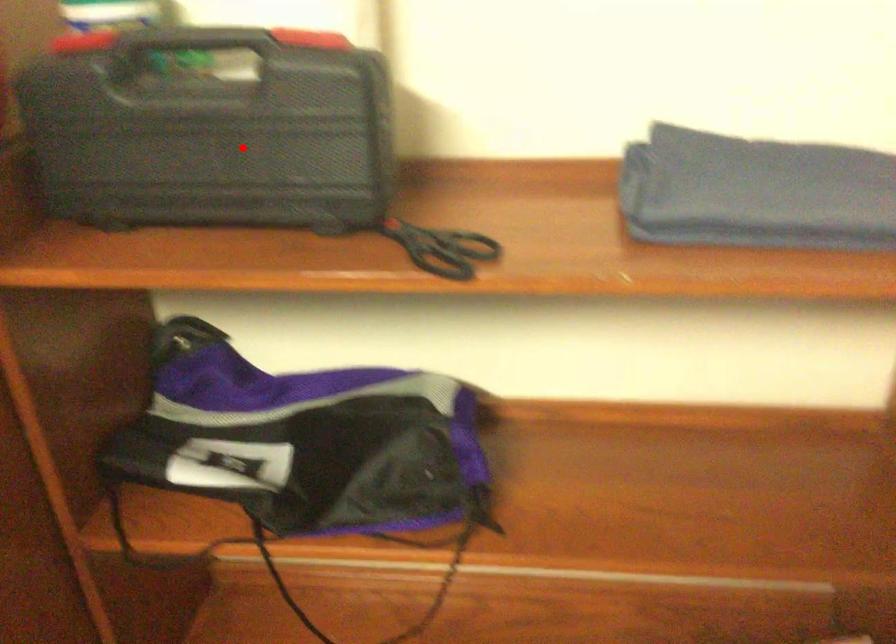
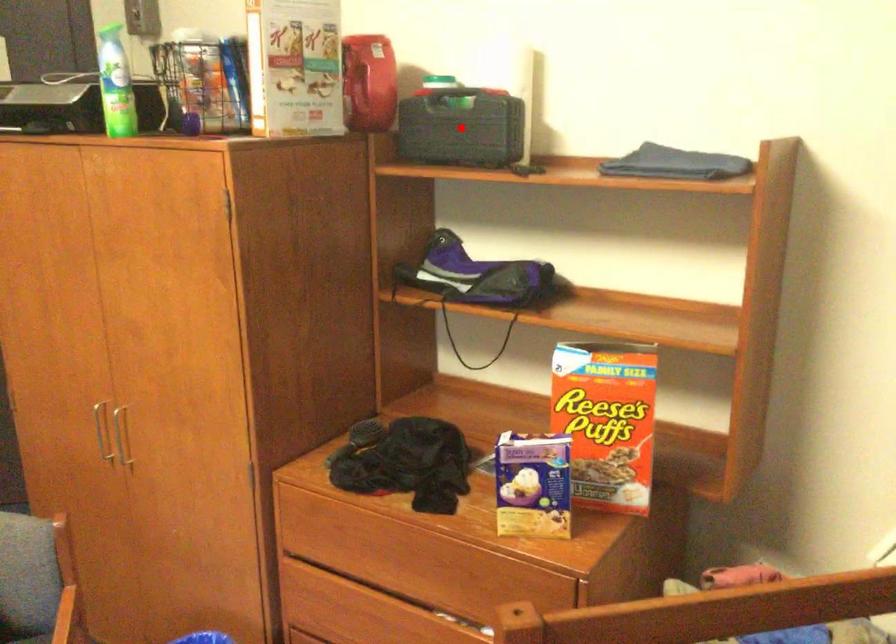
I am providing you with two images of the same scene from different viewpoints. A red point is marked on the first image and another point is marked on the second image. Do the highlighted points in image1 and image2 indicate the same real-world spot?

Yes